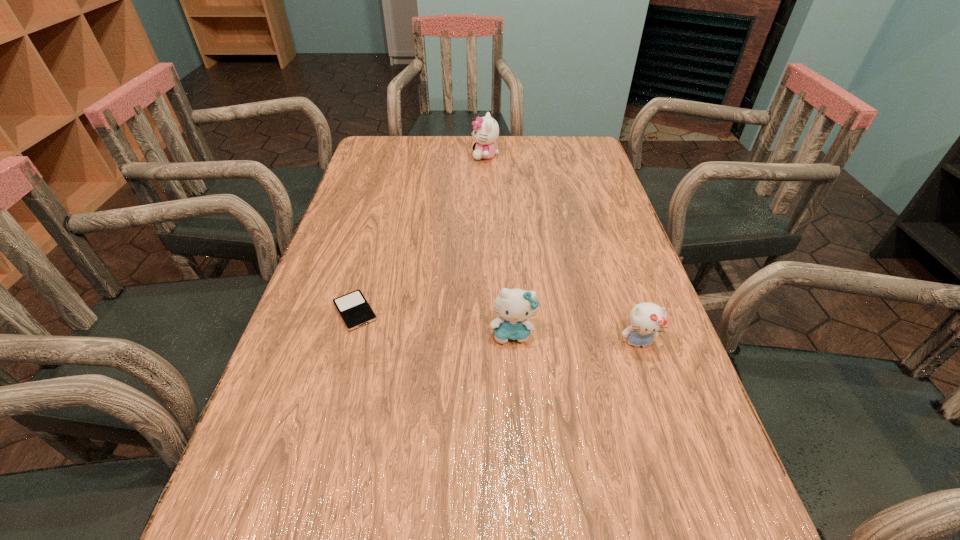
Locate an element on the screen. The width and height of the screenshot is (960, 540). the farthest object is located at coordinates (486, 130).

Where is `the rightmost object`? The height and width of the screenshot is (540, 960). the rightmost object is located at coordinates (646, 319).

Where is `the shortest object`? This screenshot has height=540, width=960. the shortest object is located at coordinates (355, 311).

The width and height of the screenshot is (960, 540). What are the coordinates of `the leftmost object` in the screenshot? It's located at (355, 311).

Identify the location of vacant space located on the front-facing side of the farthest kitten. (397, 156).

This screenshot has width=960, height=540. Find the location of `free spot located on the front-facing side of the farthest kitten`. free spot located on the front-facing side of the farthest kitten is located at coordinates (407, 156).

This screenshot has height=540, width=960. What are the coordinates of `free spot located on the front-facing side of the farthest kitten` in the screenshot? It's located at (373, 156).

The height and width of the screenshot is (540, 960). In order to click on vacant space situated on the front-facing side of the rightmost object in this screenshot , I will do click(x=695, y=517).

Locate an element on the screen. vacant space located on the back of the iPod is located at coordinates (380, 220).

The height and width of the screenshot is (540, 960). What are the coordinates of `object that is at the far edge` in the screenshot? It's located at (486, 130).